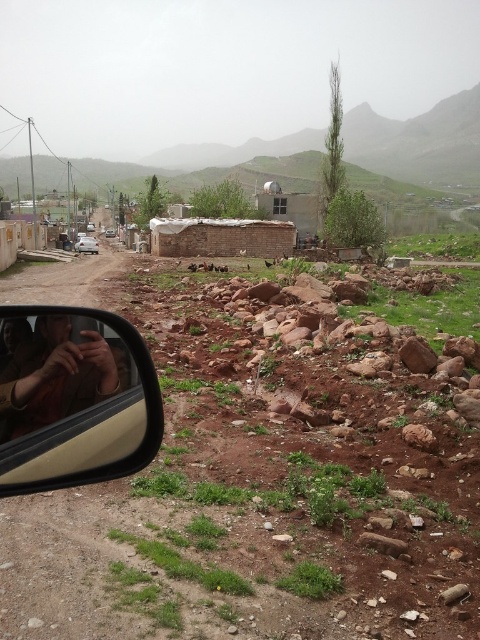
Question: Among these objects, which one is farthest from the camera?

Choices:
 (A) silver metallic car at left
 (B) brown leather jacket at left

Answer: (A)

Question: Which object is the farthest from the brown leather jacket at left?

Choices:
 (A) silver metallic car at left
 (B) matte beige rearview mirror at lower left

Answer: (A)

Question: Is matte beige rearview mirror at lower left thinner than brown leather jacket at left?

Choices:
 (A) yes
 (B) no

Answer: (B)

Question: Considering the relative positions of brown leather jacket at left and silver metallic car at left in the image provided, where is brown leather jacket at left located with respect to silver metallic car at left?

Choices:
 (A) right
 (B) left

Answer: (A)

Question: Which point is closer to the camera?

Choices:
 (A) matte beige rearview mirror at lower left
 (B) brown leather jacket at left
 (C) silver metallic car at left

Answer: (A)

Question: Can you confirm if brown leather jacket at left is positioned to the right of silver metallic car at left?

Choices:
 (A) no
 (B) yes

Answer: (B)